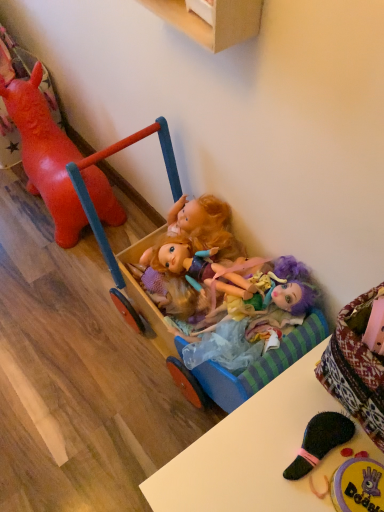
Find the location of a particular element. The width and height of the screenshot is (384, 512). blank area to the left of plush purple doll at lower right, acting as the first toy starting from the bottom is located at coordinates (248, 468).